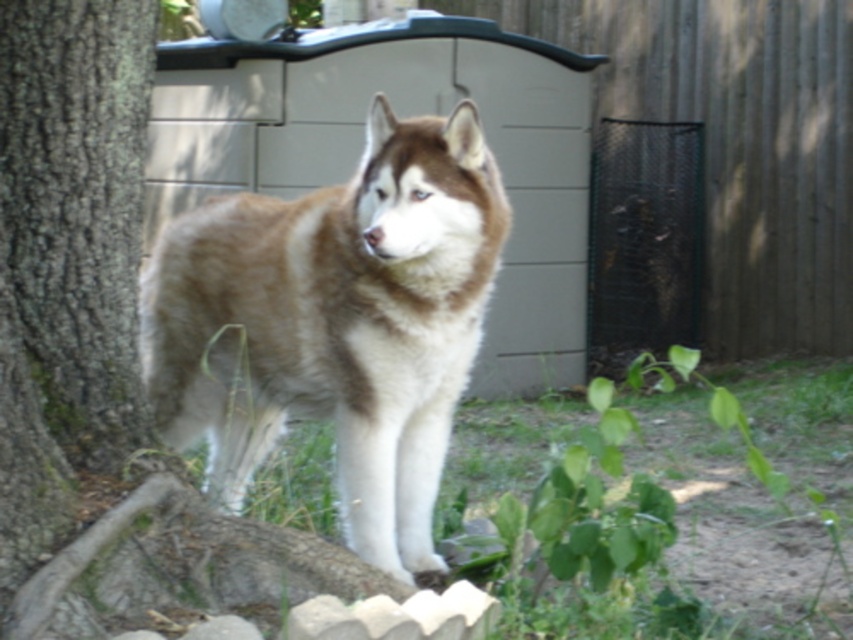
Question: Which object is farther from the camera taking this photo?

Choices:
 (A) brown rough tree trunk at left
 (B) brown and white fur at center

Answer: (B)

Question: Does brown and white fur at center have a greater width compared to brown rough tree trunk at left?

Choices:
 (A) yes
 (B) no

Answer: (A)

Question: Does brown and white fur at center have a larger size compared to brown rough tree trunk at left?

Choices:
 (A) no
 (B) yes

Answer: (B)

Question: Observing the image, what is the correct spatial positioning of brown and white fur at center in reference to brown rough tree trunk at left?

Choices:
 (A) above
 (B) below

Answer: (B)